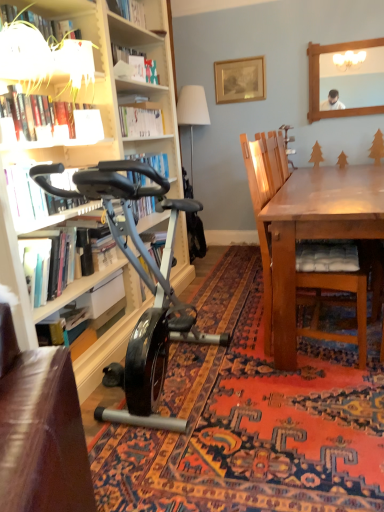
What do you see at coordinates (53, 120) in the screenshot?
I see `hardcover book at upper left, acting as the fourth book starting from the bottom` at bounding box center [53, 120].

Image resolution: width=384 pixels, height=512 pixels. What are the coordinates of `wooden frame at upper right` in the screenshot? It's located at (x=346, y=78).

The height and width of the screenshot is (512, 384). What do you see at coordinates (346, 78) in the screenshot?
I see `wooden frame at upper right` at bounding box center [346, 78].

In order to face wooden chair with cushion at right, should I rotate leftwards or rightwards?

Rotate right and turn 15.423 degrees.

Where is `white fabric lampshade at upper center`? The image size is (384, 512). white fabric lampshade at upper center is located at coordinates (191, 122).

This screenshot has height=512, width=384. Identify the location of hardcover book at lower left, the 1th book in the bottom-to-top sequence. (63, 326).

The width and height of the screenshot is (384, 512). Describe the element at coordinates (87, 278) in the screenshot. I see `hardcover book at left, the 3th book from the top` at that location.

Locate an element on the screen. shiny black exercise bike at left is located at coordinates (150, 290).

The height and width of the screenshot is (512, 384). Identify the location of hardcover book at upper left, placed as the first book when sorted from top to bottom. (53, 120).

Is hardcover book at upper left, placed as the first book when sorted from top to bottom, looking in the opposite direction of shiny black exercise bike at lower left?

hardcover book at upper left, placed as the first book when sorted from top to bottom, does not have its back to shiny black exercise bike at lower left.

Could you measure the distance between hardcover book at upper left, acting as the fourth book starting from the bottom, and shiny black exercise bike at lower left?

hardcover book at upper left, acting as the fourth book starting from the bottom, is 4.47 feet from shiny black exercise bike at lower left.

Looking at this image, is hardcover book at upper left, placed as the first book when sorted from top to bottom, inside or outside of shiny black exercise bike at lower left?

hardcover book at upper left, placed as the first book when sorted from top to bottom, is outside shiny black exercise bike at lower left.

From the picture: Considering the relative sizes of hardcover book at upper left, acting as the fourth book starting from the bottom, and shiny black exercise bike at lower left in the image provided, is hardcover book at upper left, acting as the fourth book starting from the bottom, taller than shiny black exercise bike at lower left?

Yes.

In terms of height, does white paper at upper center, which is the second shelf from left to right, look taller or shorter compared to wooden chair with cushion at right?

Answer: Clearly, white paper at upper center, which is the second shelf from left to right, is shorter compared to wooden chair with cushion at right.

I want to click on chair that is below the white paper at upper center, which appears as the 2th shelf when ordered from the bottom (from the image's perspective), so click(x=333, y=285).

Does white paper at upper center, which appears as the 2th shelf when ordered from the bottom, come in front of wooden chair with cushion at right?

No, white paper at upper center, which appears as the 2th shelf when ordered from the bottom, is further to the viewer.

Does white paper at upper center, which is counted as the 1th shelf, starting from the top, contain wooden chair with cushion at right?

No.

Locate an element on the screen. This screenshot has width=384, height=512. lamp above the hardcover book at lower left, the 1th book in the bottom-to-top sequence (from a real-world perspective) is located at coordinates (191, 122).

Between hardcover book at lower left, the 1th book in the bottom-to-top sequence, and white fabric lampshade at upper center, which one has less height?

Standing shorter between the two is hardcover book at lower left, the 1th book in the bottom-to-top sequence.

Between hardcover book at lower left, positioned as the fourth book in top-to-bottom order, and white fabric lampshade at upper center, which one has smaller width?

hardcover book at lower left, positioned as the fourth book in top-to-bottom order.

Which object is positioned more to the left, wooden chair with cushion at right or hardcover book at left, the 3th book from the top?

Positioned to the left is hardcover book at left, the 3th book from the top.

Looking at this image, can you confirm if wooden chair with cushion at right is bigger than hardcover book at left, the second book positioned from the bottom?

Yes.

Considering the positions of objects wooden chair with cushion at right and hardcover book at left, the second book positioned from the bottom, in the image provided, who is behind, wooden chair with cushion at right or hardcover book at left, the second book positioned from the bottom,?

wooden chair with cushion at right is more distant.

Which object is further away from the camera taking this photo, white glossy lampshade at upper left, the 1th shelf positioned from the left, or wooden frame at upper right?

wooden frame at upper right is further from the camera.

Is wooden frame at upper right located within white glossy lampshade at upper left, the 1th shelf positioned from the left?

No, wooden frame at upper right is not a part of white glossy lampshade at upper left, the 1th shelf positioned from the left.

Could you tell me if white glossy lampshade at upper left, the second shelf in the top-to-bottom sequence, is facing wooden frame at upper right?

No, white glossy lampshade at upper left, the second shelf in the top-to-bottom sequence, is not oriented towards wooden frame at upper right.

Which shelf is the 2nd one when counting from the right side of the matte black exercise bike at left, positioned as the 2th book in top-to-bottom order? Please provide its 2D coordinates.

[(137, 16)]

Measure the distance from matte black exercise bike at left, which ranks as the 3th book in bottom-to-top order, to white paper at upper center, which is counted as the first shelf, starting from the right.

The distance of matte black exercise bike at left, which ranks as the 3th book in bottom-to-top order, from white paper at upper center, which is counted as the first shelf, starting from the right, is 1.30 meters.

From a real-world perspective, which is physically below, matte black exercise bike at left, which ranks as the 3th book in bottom-to-top order, or white paper at upper center, which is the second shelf from left to right?

From a 3D spatial view, matte black exercise bike at left, which ranks as the 3th book in bottom-to-top order, is below.

Does point (79, 316) appear closer or farther from the camera than point (327, 410)?

Point (79, 316) is farther from the camera than point (327, 410).

Does hardcover book at lower left, the 1th book in the bottom-to-top sequence, lie behind shiny black exercise bike at lower left?

Yes, hardcover book at lower left, the 1th book in the bottom-to-top sequence, is further from the viewer.

Identify the location of mat that is above the hardcover book at lower left, the 1th book in the bottom-to-top sequence (from the image's perspective). This screenshot has height=512, width=384. (251, 419).

Is hardcover book at lower left, the 1th book in the bottom-to-top sequence, inside the boundaries of shiny black exercise bike at lower left, or outside?

hardcover book at lower left, the 1th book in the bottom-to-top sequence, exists outside the volume of shiny black exercise bike at lower left.

Locate an element on the screen. Image resolution: width=384 pixels, height=512 pixels. book that is the 3rd object located above the shiny black exercise bike at lower left (from the image's perspective) is located at coordinates (53, 120).

You are a GUI agent. You are given a task and a screenshot of the screen. Output one action in this format:
    pyautogui.click(x=<x>, y=<y>)
    Task: Click on the chair below the white paper at upper center, which is counted as the first shelf, starting from the right (from a real-world perspective)
    
    Given the screenshot: What is the action you would take?
    pyautogui.click(x=333, y=285)

From the image, which object appears to be farther from shiny black exercise bike at lower left, matte black exercise bike at left, positioned as the 2th book in top-to-bottom order, or hardcover book at lower left, positioned as the fourth book in top-to-bottom order?

Among the two, matte black exercise bike at left, positioned as the 2th book in top-to-bottom order, is located further to shiny black exercise bike at lower left.

Which object lies nearer to the anchor point wooden frame at upper right, hardcover book at upper left, acting as the fourth book starting from the bottom, or white paper at upper center, which is the second shelf from left to right?

Based on the image, white paper at upper center, which is the second shelf from left to right, appears to be nearer to wooden frame at upper right.

Based on the photo, when comparing their distances from wooden frame at upper right, does white fabric lampshade at upper center or white glossy lampshade at upper left, which is counted as the first shelf, starting from the front, seem further?

white glossy lampshade at upper left, which is counted as the first shelf, starting from the front, is positioned further to the anchor wooden frame at upper right.

When comparing their distances from shiny black exercise bike at left, does wooden chair with cushion at right or white glossy lampshade at upper left, the second shelf in the top-to-bottom sequence, seem further?

Based on the image, white glossy lampshade at upper left, the second shelf in the top-to-bottom sequence, appears to be further to shiny black exercise bike at left.

Estimate the real-world distances between objects in this image. Which object is closer to matte black exercise bike at left, positioned as the 2th book in top-to-bottom order, hardcover book at left, the 3th book from the top, or shiny black exercise bike at lower left?

hardcover book at left, the 3th book from the top, lies closer to matte black exercise bike at left, positioned as the 2th book in top-to-bottom order, than the other object.

Looking at the image, which one is located further to hardcover book at left, the 3th book from the top, matte black exercise bike at left, which ranks as the 3th book in bottom-to-top order, or white glossy lampshade at upper left, the second shelf in the top-to-bottom sequence?

The object further to hardcover book at left, the 3th book from the top, is white glossy lampshade at upper left, the second shelf in the top-to-bottom sequence.

Looking at the image, which one is located further to hardcover book at upper left, placed as the first book when sorted from top to bottom, matte black exercise bike at left, positioned as the 2th book in top-to-bottom order, or gold-framed picture at upper center?

Among the two, gold-framed picture at upper center is located further to hardcover book at upper left, placed as the first book when sorted from top to bottom.

Which object lies further to the anchor point shiny black exercise bike at lower left, wooden chair with cushion at right or shiny black exercise bike at left?

wooden chair with cushion at right.

Image resolution: width=384 pixels, height=512 pixels. In order to click on chair between hardcover book at left, the 3th book from the top, and wooden frame at upper right in the front-back direction in this screenshot , I will do `click(333, 285)`.

The height and width of the screenshot is (512, 384). Find the location of `book located between hardcover book at left, the second book positioned from the bottom, and gold-framed picture at upper center in the depth direction`. book located between hardcover book at left, the second book positioned from the bottom, and gold-framed picture at upper center in the depth direction is located at coordinates (63, 326).

Image resolution: width=384 pixels, height=512 pixels. I want to click on book between wooden chair with cushion at right and white fabric lampshade at upper center from front to back, so click(63, 326).

The image size is (384, 512). I want to click on mirror positioned between wooden chair with cushion at right and white fabric lampshade at upper center from near to far, so click(346, 78).